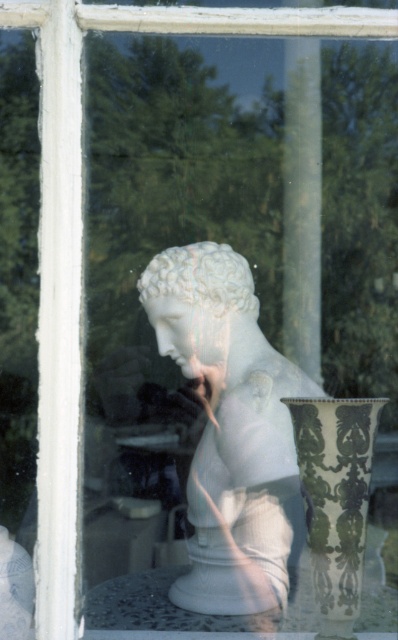
Question: Based on their relative distances, which object is nearer to the green and white ceramic vase at center?

Choices:
 (A) white marble vase at lower center
 (B) white marble bust at center

Answer: (B)

Question: Which object is the closest to the white marble vase at lower center?

Choices:
 (A) green and white ceramic vase at center
 (B) white marble bust at center
 (C) white marble head at center

Answer: (A)

Question: Is the position of white marble vase at lower center less distant than that of white marble head at center?

Choices:
 (A) no
 (B) yes

Answer: (B)

Question: Which point is farther from the camera taking this photo?

Choices:
 (A) (335, 545)
 (B) (218, 465)
 (C) (216, 248)

Answer: (C)

Question: Is white marble bust at center wider than white marble head at center?

Choices:
 (A) yes
 (B) no

Answer: (A)

Question: Can you confirm if white marble bust at center is smaller than white marble head at center?

Choices:
 (A) no
 (B) yes

Answer: (A)